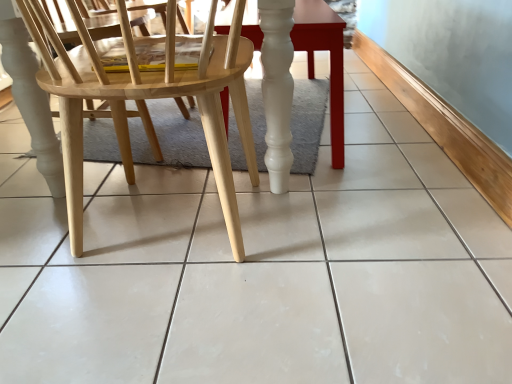
Find the location of `vacant space in front of smooth glossy wood table at center`. vacant space in front of smooth glossy wood table at center is located at coordinates (344, 198).